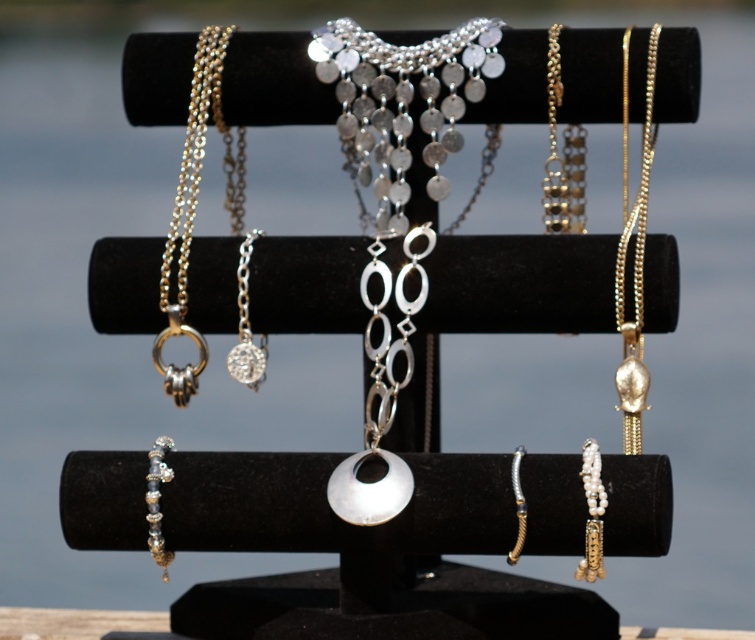
This screenshot has width=755, height=640. Describe the element at coordinates (633, 259) in the screenshot. I see `gold chain necklace at right` at that location.

Which of these two, gold chain necklace at right or gold chain link necklace at upper right, stands taller?

gold chain necklace at right

Where is `gold chain necklace at right`? This screenshot has width=755, height=640. gold chain necklace at right is located at coordinates (633, 259).

Is point (626, 60) less distant than point (516, 452)?

No, it is not.

What do you see at coordinates (633, 259) in the screenshot?
I see `gold chain necklace at right` at bounding box center [633, 259].

Is point (624, 364) behind point (519, 460)?

That is True.

In order to click on gold chain necklace at right in this screenshot , I will do `click(633, 259)`.

Is gold chain link necklace at upper right to the right of gold textured bracelet at center from the viewer's perspective?

Indeed, gold chain link necklace at upper right is positioned on the right side of gold textured bracelet at center.

I want to click on gold chain link necklace at upper right, so click(x=562, y=157).

Identify the location of gold chain link necklace at upper right. (562, 157).